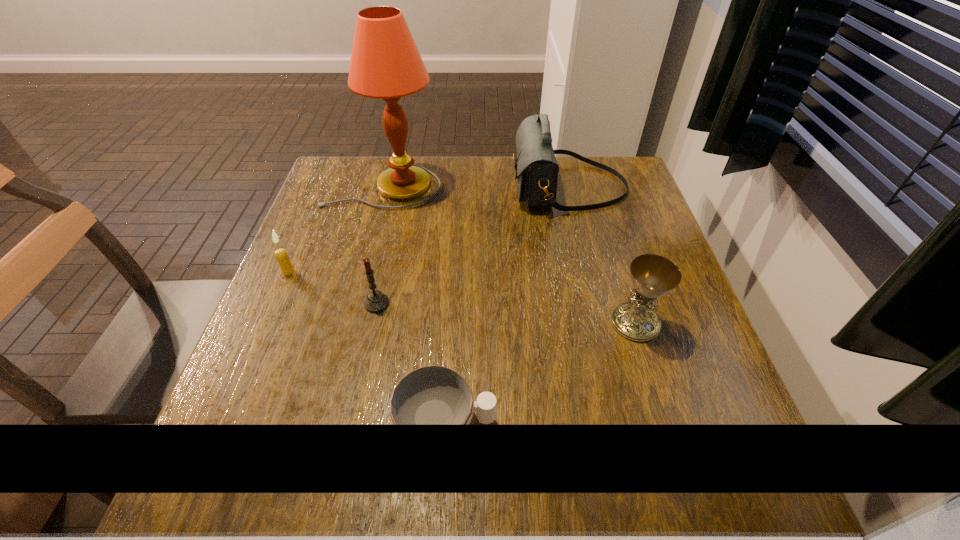
At what (x,y) coordinates should I click in order to perform the action: click on chalice that is at the right edge. Please return your answer as a coordinate pair (x, y). Looking at the image, I should click on (653, 276).

At what (x,y) coordinates should I click in order to perform the action: click on object positioned at the far left corner. Please return your answer as a coordinate pair (x, y). The width and height of the screenshot is (960, 540). Looking at the image, I should click on (385, 64).

Identify the location of object located in the far right corner section of the desktop. (536, 167).

The image size is (960, 540). In the image, there is a desktop. Identify the location of free region at the far edge. (494, 172).

The image size is (960, 540). Identify the location of vacant space at the near edge of the desktop. (374, 510).

Where is `free space at the left edge of the desktop`? The width and height of the screenshot is (960, 540). free space at the left edge of the desktop is located at coordinates tap(249, 356).

This screenshot has height=540, width=960. I want to click on vacant region at the right edge of the desktop, so click(696, 328).

This screenshot has width=960, height=540. Identify the location of vacant space at the near left corner of the desktop. (207, 485).

The image size is (960, 540). What are the coordinates of `vacant point at the far right corner` in the screenshot? It's located at (584, 170).

Where is `free space that is in between the lamp and the farther candle`? This screenshot has width=960, height=540. free space that is in between the lamp and the farther candle is located at coordinates (336, 230).